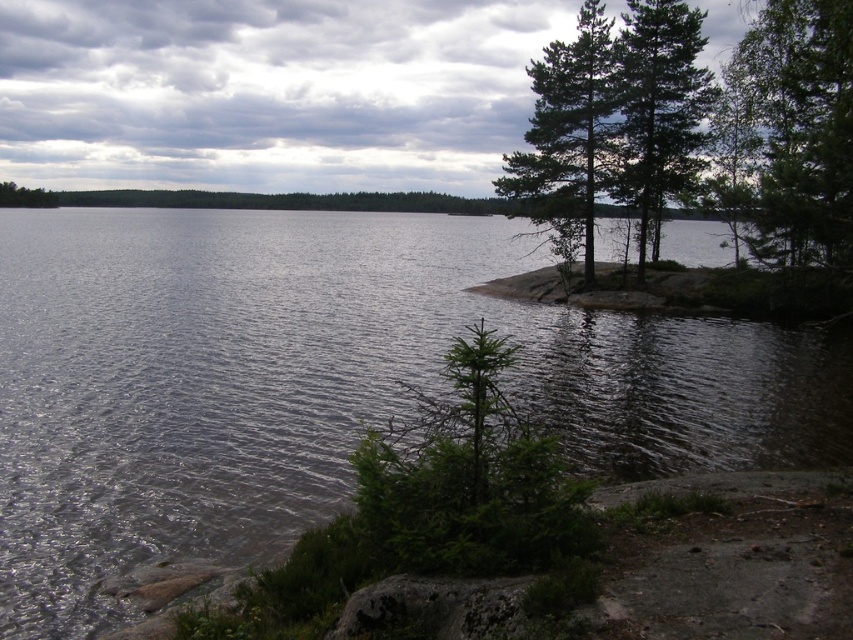
Which is below, dark gray water at center or green matte tree at right?

dark gray water at center is below.

Which is more to the right, dark gray water at center or green matte tree at right?

green matte tree at right

What do you see at coordinates (318, 381) in the screenshot?
I see `dark gray water at center` at bounding box center [318, 381].

This screenshot has width=853, height=640. I want to click on dark gray water at center, so click(x=318, y=381).

Is dark gray water at center closer to camera compared to green matte tree at upper right?

That is True.

Does dark gray water at center have a lesser height compared to green matte tree at upper right?

Correct, dark gray water at center is not as tall as green matte tree at upper right.

At what (x,y) coordinates should I click in order to perform the action: click on dark gray water at center. Please return your answer as a coordinate pair (x, y). Looking at the image, I should click on (318, 381).

Is green matte tree at upper right to the right of green textured pine trees at upper right from the viewer's perspective?

Incorrect, green matte tree at upper right is not on the right side of green textured pine trees at upper right.

Is green matte tree at upper right closer to the viewer compared to green textured pine trees at upper right?

Yes, it is.

Where is `green matte tree at upper right`? The height and width of the screenshot is (640, 853). green matte tree at upper right is located at coordinates (798, 131).